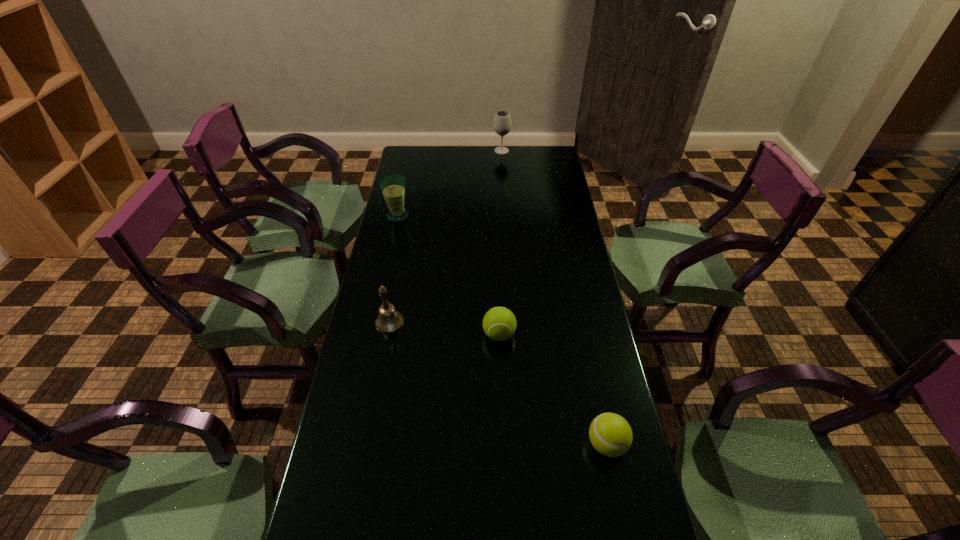
Identify the location of free spot between the bell and the left tennis ball. (444, 328).

Find the location of a particular element. This screenshot has width=960, height=540. empty location between the left tennis ball and the bell is located at coordinates (444, 328).

The width and height of the screenshot is (960, 540). Find the location of `free space between the nearest object and the left tennis ball`. free space between the nearest object and the left tennis ball is located at coordinates (553, 389).

The width and height of the screenshot is (960, 540). What are the coordinates of `free space between the second farthest object and the left tennis ball` in the screenshot? It's located at (448, 275).

Where is `free space that is in between the second farthest object and the farther tennis ball`? free space that is in between the second farthest object and the farther tennis ball is located at coordinates (448, 275).

The image size is (960, 540). In order to click on free space between the bell and the second farthest object in this screenshot , I will do `click(394, 269)`.

Identify the location of free space between the left tennis ball and the rightmost object. (553, 389).

At what (x,y) coordinates should I click in order to perform the action: click on the fourth closest object to the nearer tennis ball. Please return your answer as a coordinate pair (x, y). Looking at the image, I should click on (502, 124).

Select which object appears as the fourth closest to the nearest object. Please provide its 2D coordinates. Your answer should be formatted as a tuple, i.e. [(x, y)], where the tuple contains the x and y coordinates of a point satisfying the conditions above.

[(502, 124)]

Identify the location of free space that satisfies the following two spatial constraints: 1. on the front side of the right tennis ball; 2. on the right side of the bell. (367, 444).